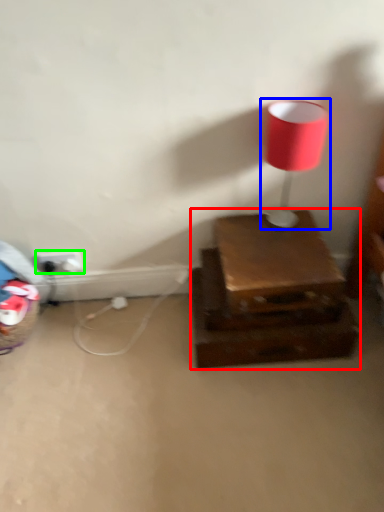
Question: Which object is the closest to the furniture (highlighted by a red box)? Choose among these: lamp (highlighted by a blue box) or electric outlet (highlighted by a green box).

Choices:
 (A) lamp
 (B) electric outlet

Answer: (A)